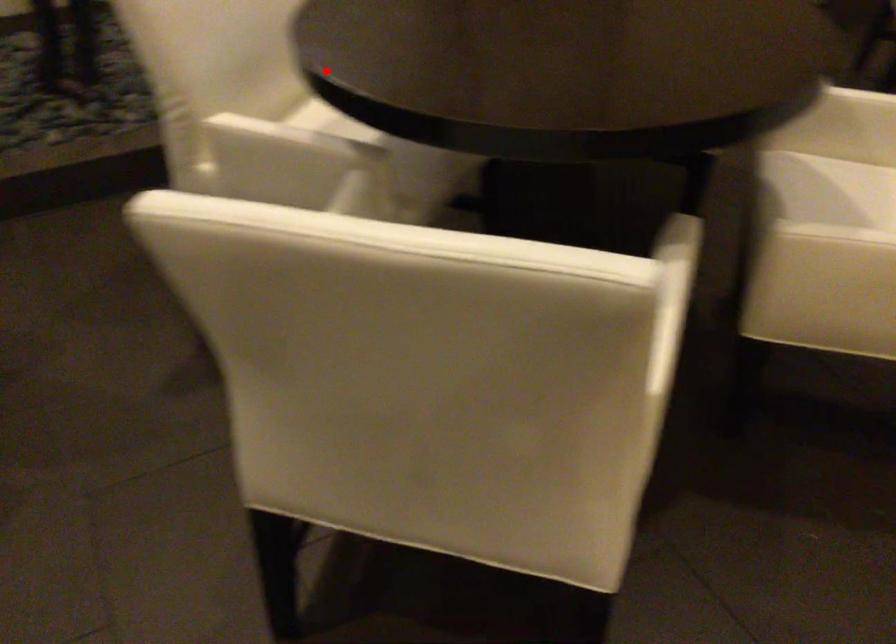
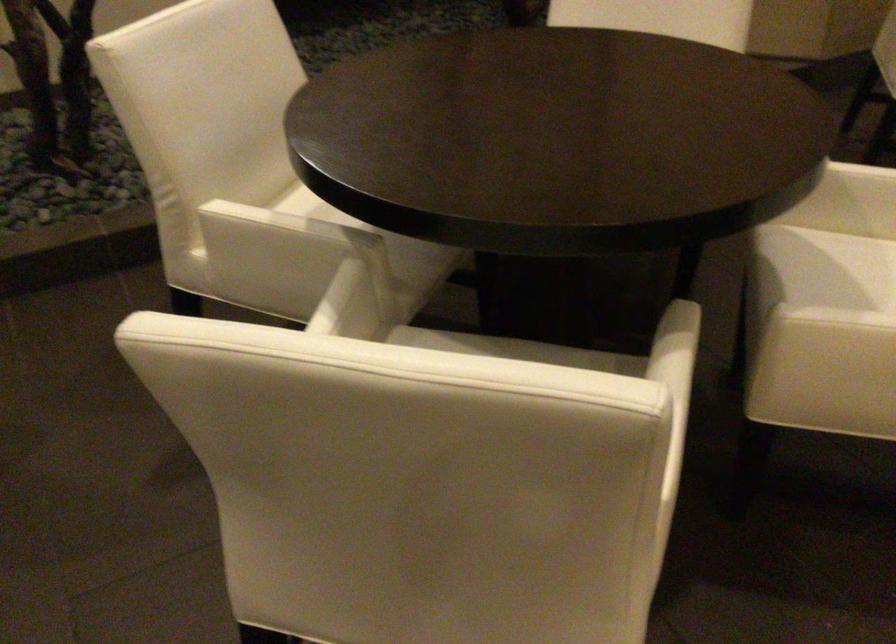
Locate, in the second image, the point that corresponds to the highlighted location in the first image.

(316, 166)